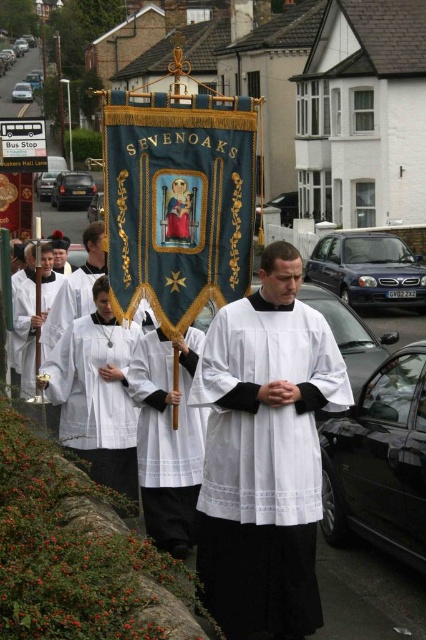
Question: Can you confirm if white matte/soft fabric robe at center is positioned above white matte robe at center?

Choices:
 (A) yes
 (B) no

Answer: (B)

Question: Is white matte/soft fabric robe at center to the left of white matte robe at center from the viewer's perspective?

Choices:
 (A) yes
 (B) no

Answer: (B)

Question: Which object appears farthest from the camera in this image?

Choices:
 (A) white smooth fabric at center
 (B) white matte robe at center
 (C) white matte/soft fabric robe at center

Answer: (B)

Question: Does white cotton robe at center come behind white smooth fabric at center?

Choices:
 (A) no
 (B) yes

Answer: (B)

Question: Which object is the farthest from the white cotton robe at center?

Choices:
 (A) white smooth fabric at center
 (B) white matte robe at center

Answer: (B)

Question: Which of these objects is positioned closest to the white smooth fabric at center?

Choices:
 (A) white matte/soft fabric robe at center
 (B) white matte robe at center
 (C) white cotton robe at center

Answer: (C)